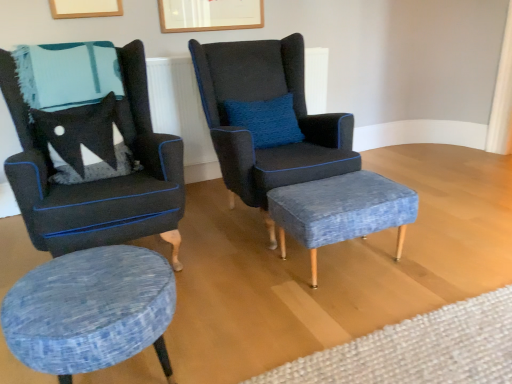
The image size is (512, 384). Find the location of `free spot to the left of blue fabric stool at center, the 1th stool viewed from the back`. free spot to the left of blue fabric stool at center, the 1th stool viewed from the back is located at coordinates click(244, 283).